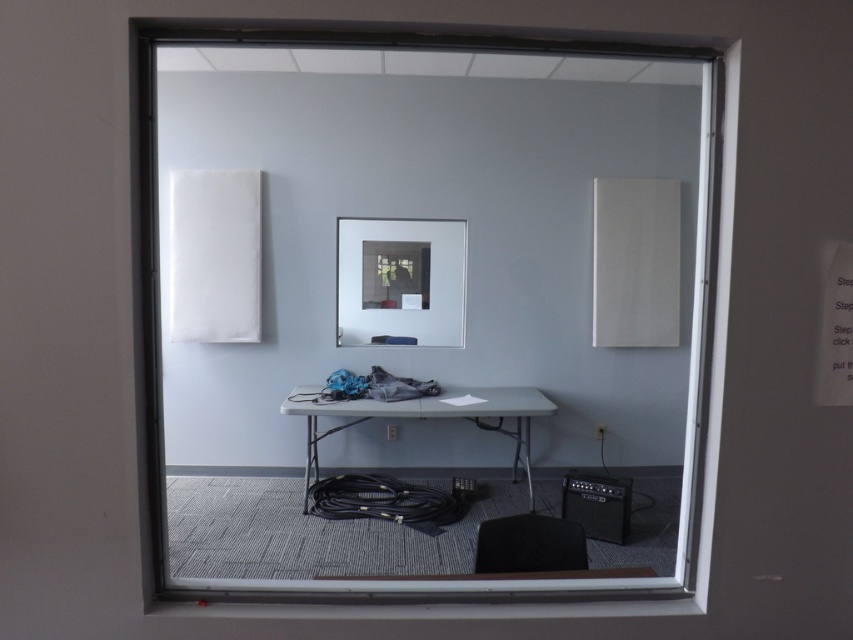
Can you confirm if clear glass mirror at center is wider than metallic gray plug at center?

Correct, the width of clear glass mirror at center exceeds that of metallic gray plug at center.

Between clear glass mirror at center and metallic gray plug at center, which one is positioned lower?

Positioned lower is metallic gray plug at center.

Does point (457, 220) come closer to viewer compared to point (390, 433)?

Yes, point (457, 220) is in front of point (390, 433).

Image resolution: width=853 pixels, height=640 pixels. I want to click on clear glass mirror at center, so click(x=399, y=280).

Which is above, transparent glass window at center or white plastic table at center?

transparent glass window at center

Describe the element at coordinates (410, 337) in the screenshot. This screenshot has width=853, height=640. I see `transparent glass window at center` at that location.

Locate an element on the screen. Image resolution: width=853 pixels, height=640 pixels. transparent glass window at center is located at coordinates (410, 337).

Is point (577, 333) farther from viewer compared to point (389, 422)?

Yes, it is behind point (389, 422).

The width and height of the screenshot is (853, 640). What are the coordinates of `transparent glass window at center` in the screenshot? It's located at (410, 337).

Describe the element at coordinates (410, 337) in the screenshot. This screenshot has width=853, height=640. I see `transparent glass window at center` at that location.

The image size is (853, 640). I want to click on transparent glass window at center, so click(410, 337).